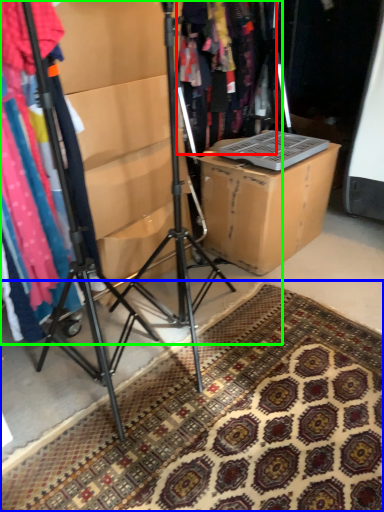
Question: Which object is positioned farthest from clothing (highlighted by a red box)? Select from doormat (highlighted by a blue box) and closet (highlighted by a green box).

Choices:
 (A) doormat
 (B) closet

Answer: (A)